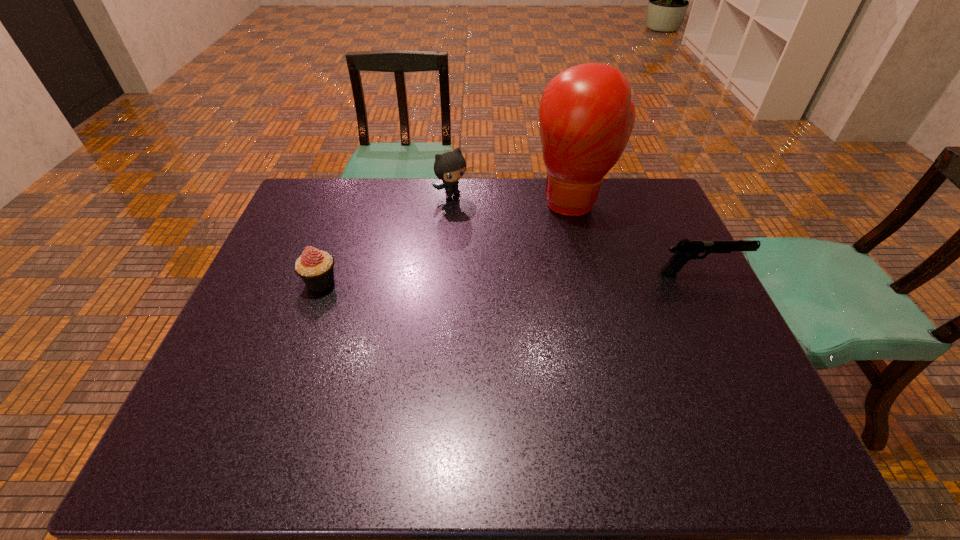
In the image, there is a desktop. At what (x,y) coordinates should I click in order to perform the action: click on vacant space at the near edge. Please return your answer as a coordinate pair (x, y). Looking at the image, I should click on (331, 413).

Where is `free space at the left edge of the desktop`? This screenshot has height=540, width=960. free space at the left edge of the desktop is located at coordinates (305, 228).

What are the coordinates of `free space at the near left corner of the desktop` in the screenshot? It's located at (210, 394).

At what (x,y) coordinates should I click in order to perform the action: click on blank area at the far right corner. Please return your answer as a coordinate pair (x, y). Looking at the image, I should click on (660, 212).

Locate an element on the screen. free point between the cupcake and the third object from left to right is located at coordinates (447, 242).

Find the location of a particular element. This screenshot has width=960, height=540. vacant space that's between the leftmost object and the kitten is located at coordinates (387, 238).

At what (x,y) coordinates should I click in order to perform the action: click on free space between the leftmost object and the gun. Please return your answer as a coordinate pair (x, y). The width and height of the screenshot is (960, 540). Looking at the image, I should click on (511, 278).

This screenshot has height=540, width=960. Find the location of `empty location between the leftmost object and the second object from left to right`. empty location between the leftmost object and the second object from left to right is located at coordinates (387, 238).

Find the location of `empty space that is in between the second tallest object and the tallest object`. empty space that is in between the second tallest object and the tallest object is located at coordinates (514, 198).

Find the location of a particular element. free spot between the cupcake and the third object from left to right is located at coordinates (447, 242).